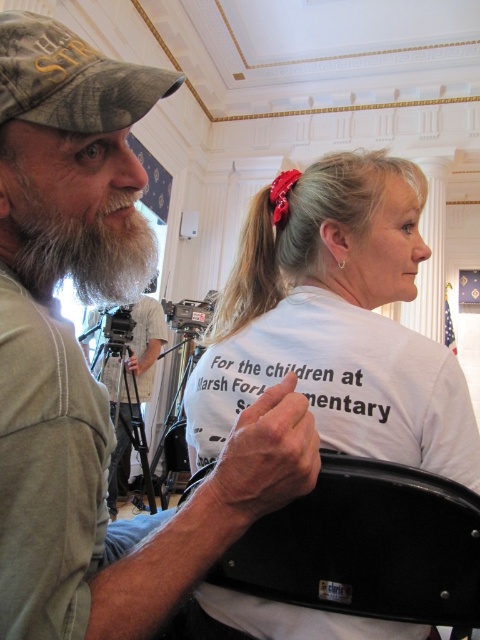
You are a photographer at an event. You notice the red fabric hairband at upper center and the black plastic video camera at center. Which object is closer to the camera lens?

The red fabric hairband at upper center is closer to the camera lens since it is in front of the black plastic video camera at center.

From the picture: You are standing in the room and want to take a photo of both the man and the woman. The man is at point (244, 268) and the woman is at point (192, 332). Which point is closer to you so that you can focus on them properly?

Point (244, 268) is closer to the camera than point (192, 332), so focusing on the man at point (244, 268) first would ensure proper focus since he is nearer to your position.

You are a photographer at the event and need to adjust the focus of your camera. The red fabric hairband at upper center and the black plastic video camera at center are in your view. Which object is closer to your camera lens?

The red fabric hairband at upper center is 4.03 meters away from the black plastic video camera at center. Since the red fabric hairband is at upper center and the camera is at center, the black plastic video camera at center is closer to the photographer.